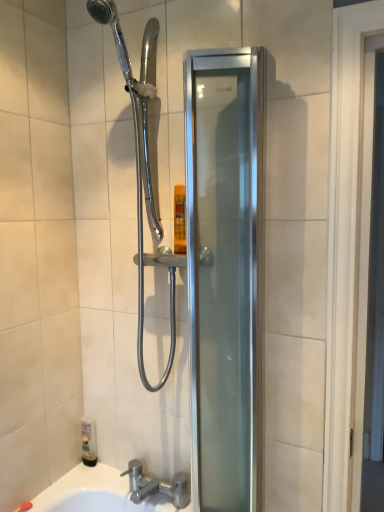
Locate an element on the screen. satin silver glass shower door at center is located at coordinates click(225, 275).

The image size is (384, 512). What do you see at coordinates (156, 485) in the screenshot?
I see `silver metallic faucet at lower center` at bounding box center [156, 485].

You are a GUI agent. You are given a task and a screenshot of the screen. Output one action in this format:
    pyautogui.click(x=<x>, y=<y>)
    Task: Click on the translucent plastic bottle at lower left
    The image size is (384, 512).
    Given the screenshot: What is the action you would take?
    pyautogui.click(x=88, y=441)

Based on the photo, measure the distance between translucent plastic bottle at lower left and camera.

The distance of translucent plastic bottle at lower left from camera is 1.64 meters.

I want to click on satin silver glass shower door at center, so click(x=225, y=275).

Considering the relative positions of satin silver glass shower door at center and silver metallic faucet at lower center in the image provided, is satin silver glass shower door at center to the left of silver metallic faucet at lower center from the viewer's perspective?

Incorrect, satin silver glass shower door at center is not on the left side of silver metallic faucet at lower center.

Is satin silver glass shower door at center situated inside silver metallic faucet at lower center or outside?

satin silver glass shower door at center is outside silver metallic faucet at lower center.

Which of these two, satin silver glass shower door at center or silver metallic faucet at lower center, is thinner?

satin silver glass shower door at center.

Considering the relative sizes of silver metallic faucet at lower center and translucent plastic bottle at lower left in the image provided, is silver metallic faucet at lower center bigger than translucent plastic bottle at lower left?

Yes.

Which of these two, silver metallic faucet at lower center or translucent plastic bottle at lower left, stands taller?

With more height is translucent plastic bottle at lower left.

Is silver metallic faucet at lower center in front of translucent plastic bottle at lower left?

Yes, the depth of silver metallic faucet at lower center is less than that of translucent plastic bottle at lower left.

Considering the relative positions of translucent plastic bottle at lower left and satin silver glass shower door at center in the image provided, is translucent plastic bottle at lower left to the left or to the right of satin silver glass shower door at center?

Based on their positions, translucent plastic bottle at lower left is located to the left of satin silver glass shower door at center.

Is satin silver glass shower door at center inside translucent plastic bottle at lower left?

Definitely not — satin silver glass shower door at center is not inside translucent plastic bottle at lower left.

Considering the relative positions of translucent plastic bottle at lower left and satin silver glass shower door at center in the image provided, is translucent plastic bottle at lower left behind satin silver glass shower door at center?

Yes, it is.

Is translucent plastic bottle at lower left facing away from satin silver glass shower door at center?

translucent plastic bottle at lower left is not turned away from satin silver glass shower door at center.

Does silver metallic faucet at lower center have a greater width compared to satin silver glass shower door at center?

Correct, the width of silver metallic faucet at lower center exceeds that of satin silver glass shower door at center.

Based on the photo, from a real-world perspective, does silver metallic faucet at lower center sit lower than satin silver glass shower door at center?

Yes, from a real-world perspective, silver metallic faucet at lower center is beneath satin silver glass shower door at center.

Between silver metallic faucet at lower center and satin silver glass shower door at center, which one is positioned behind?

silver metallic faucet at lower center is more distant.

Between point (179, 504) and point (232, 489), which one is positioned behind?

The point (179, 504) is farther from the camera.

Could translucent plastic bottle at lower left be considered to be inside satin silver glass shower door at center?

No, translucent plastic bottle at lower left is not inside satin silver glass shower door at center.

Is satin silver glass shower door at center turned away from translucent plastic bottle at lower left?

No, satin silver glass shower door at center is not facing away from translucent plastic bottle at lower left.

Is satin silver glass shower door at center positioned far away from translucent plastic bottle at lower left?

That's not correct — satin silver glass shower door at center is a little close to translucent plastic bottle at lower left.

Looking at this image, how distant is satin silver glass shower door at center from translucent plastic bottle at lower left?

33.13 inches.

Identify the location of toiletry that appears above the silver metallic faucet at lower center (from the image's perspective). (x=88, y=441).

Is translucent plastic bottle at lower left next to silver metallic faucet at lower center?

No, translucent plastic bottle at lower left is not in contact with silver metallic faucet at lower center.

Between translucent plastic bottle at lower left and silver metallic faucet at lower center, which one has smaller width?

With smaller width is translucent plastic bottle at lower left.

Considering the points (83, 455) and (132, 497), which point is behind, point (83, 455) or point (132, 497)?

The point (83, 455) is behind.

In the image, there is a silver metallic faucet at lower center. At what (x,y) coordinates should I click in order to perform the action: click on screen door above it (from the image's perspective). Please return your answer as a coordinate pair (x, y). Looking at the image, I should click on point(225,275).

Where is `tap on the right side of translucent plastic bottle at lower left`? tap on the right side of translucent plastic bottle at lower left is located at coordinates (156, 485).

Looking at the image, which one is located closer to silver metallic faucet at lower center, satin silver glass shower door at center or translucent plastic bottle at lower left?

translucent plastic bottle at lower left is positioned closer to the anchor silver metallic faucet at lower center.

When comparing their distances from translucent plastic bottle at lower left, does silver metallic faucet at lower center or satin silver glass shower door at center seem closer?

silver metallic faucet at lower center lies closer to translucent plastic bottle at lower left than the other object.

Looking at the image, which one is located further to satin silver glass shower door at center, silver metallic faucet at lower center or translucent plastic bottle at lower left?

The object further to satin silver glass shower door at center is translucent plastic bottle at lower left.

Which object lies further to the anchor point translucent plastic bottle at lower left, satin silver glass shower door at center or silver metallic faucet at lower center?

Based on the image, satin silver glass shower door at center appears to be further to translucent plastic bottle at lower left.

Looking at the image, which one is located closer to silver metallic faucet at lower center, translucent plastic bottle at lower left or satin silver glass shower door at center?

translucent plastic bottle at lower left is positioned closer to the anchor silver metallic faucet at lower center.

Based on their spatial positions, is translucent plastic bottle at lower left or silver metallic faucet at lower center closer to satin silver glass shower door at center?

Based on the image, silver metallic faucet at lower center appears to be nearer to satin silver glass shower door at center.

At what (x,y) coordinates should I click in order to perform the action: click on toiletry between satin silver glass shower door at center and silver metallic faucet at lower center from top to bottom. Please return your answer as a coordinate pair (x, y). This screenshot has width=384, height=512. Looking at the image, I should click on (88, 441).